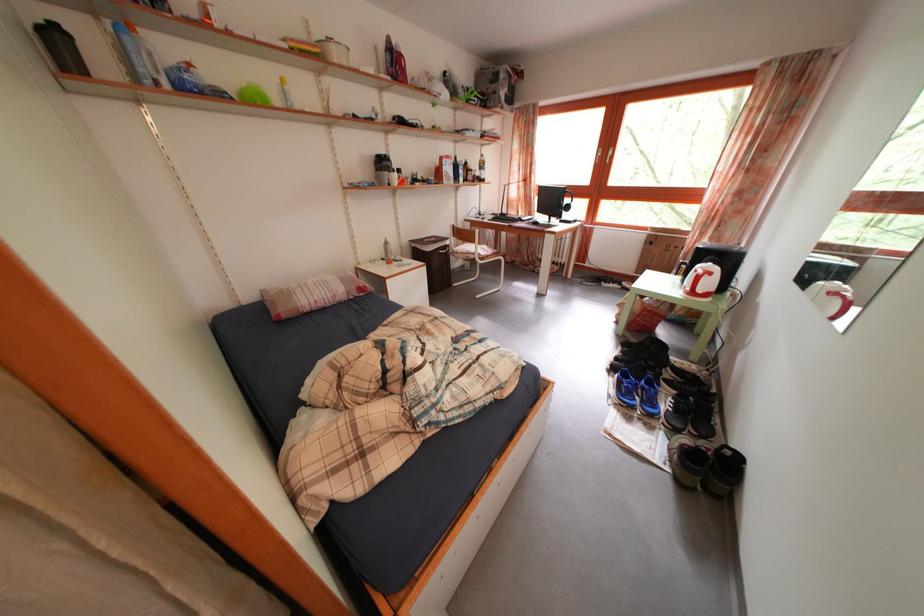
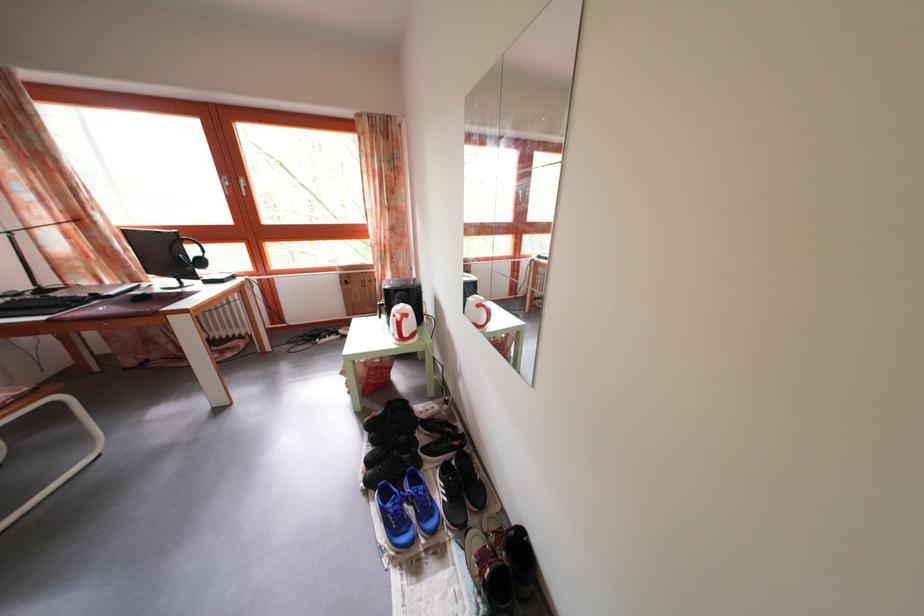
Question: The camera is either moving clockwise (left) or counter-clockwise (right) around the object. The first image is from the beginning of the video and the second image is from the end. Is the camera moving left or right when shooting the video?

Choices:
 (A) Left
 (B) Right

Answer: (A)